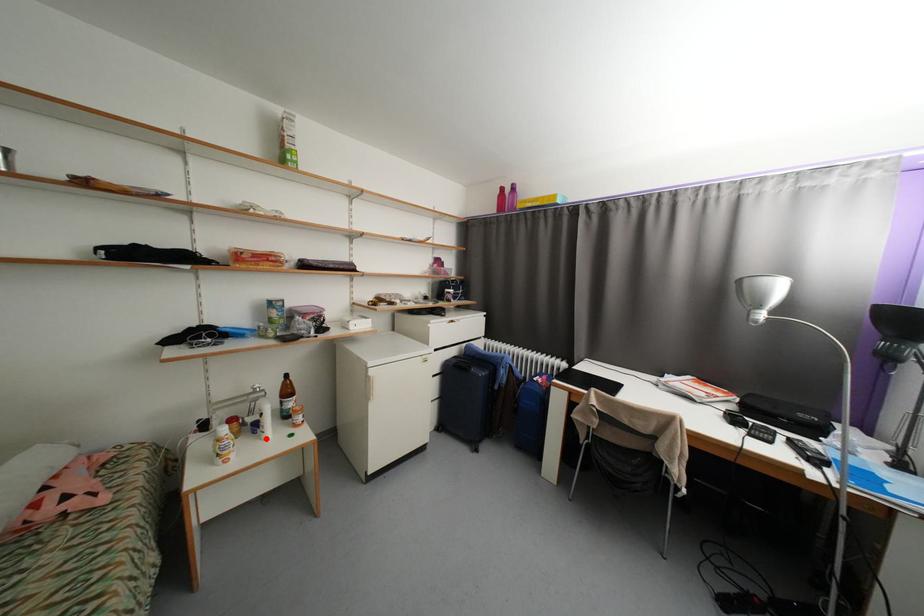
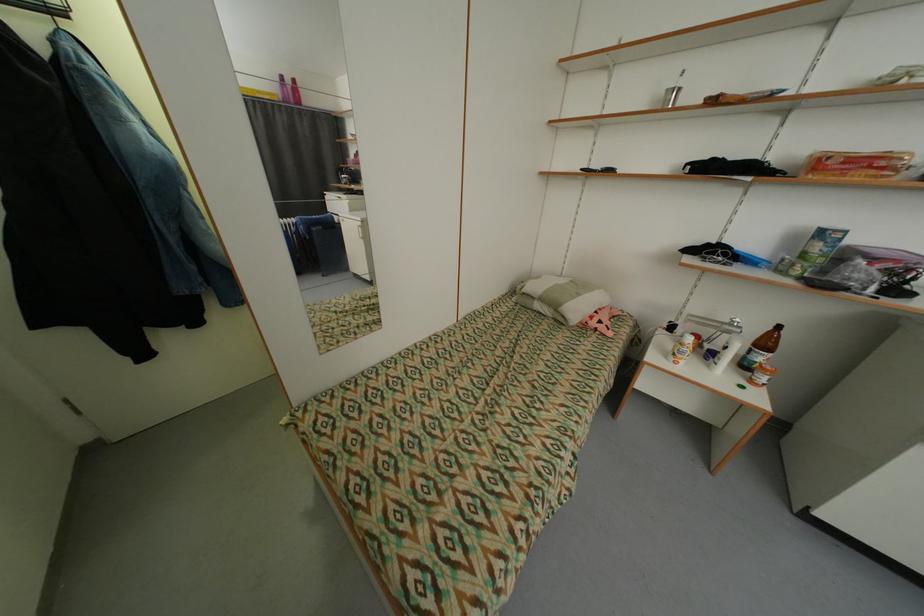
Where in the second image is the point corresponding to the highlighted location from the first image?

(714, 367)